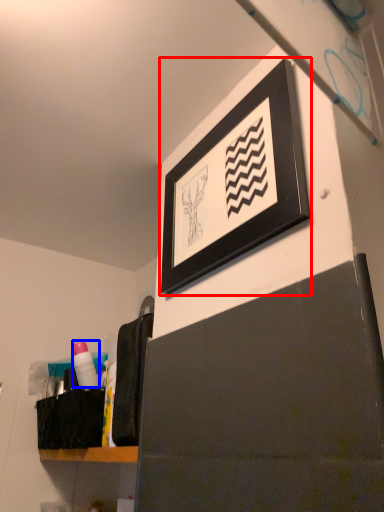
Question: Which point is closer to the camera, picture frame (highlighted by a red box) or toiletry (highlighted by a blue box)?

Choices:
 (A) picture frame
 (B) toiletry

Answer: (A)